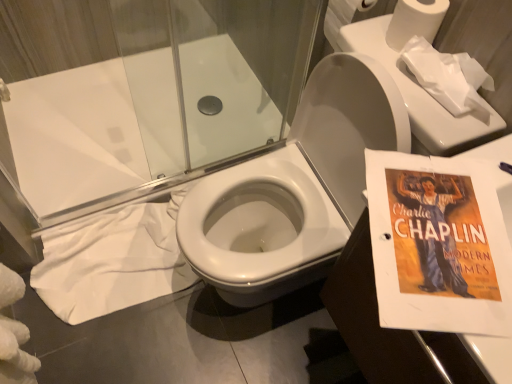
Where is `vacant area that is situated to the right of white fabric at lower left`? This screenshot has width=512, height=384. vacant area that is situated to the right of white fabric at lower left is located at coordinates tap(214, 326).